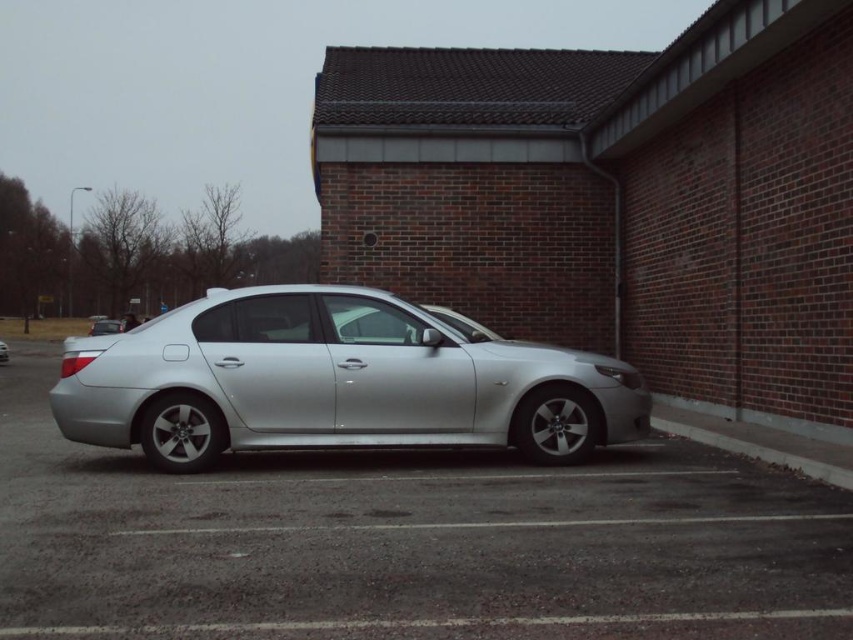
You are a parking attendant and need to fit both the silver metallic car at center and the satin silver car at center into a parking space that is 5 meters long. Given their sizes, which car should you park first to ensure both fit?

The silver metallic car at center is larger in size than the satin silver car at center. To ensure both fit into the 5 meters long parking space, park the larger silver metallic car at center first, then the smaller satin silver car at center.

You are a delivery person trying to park your van behind the silver metallic car at center and the gray concrete curb at lower right. Can you park your van behind both objects?

The silver metallic car at center is in front of gray concrete curb at lower right, so the van cannot be parked behind both objects since the car is blocking the path to the curb.